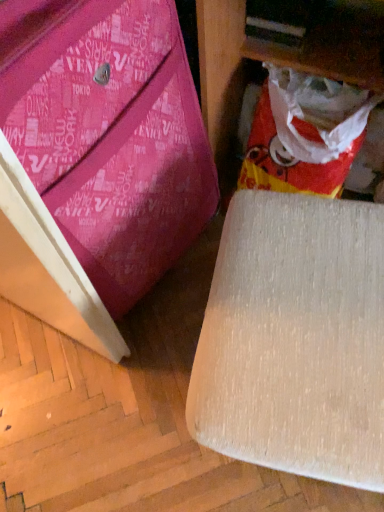
Question: Can you confirm if beige fabric chair at lower right, the first furniture from the right, is positioned to the left of red/yellow plastic bag at lower right?

Choices:
 (A) no
 (B) yes

Answer: (B)

Question: Is beige fabric chair at lower right, which is the 2th furniture in left-to-right order, positioned far away from red/yellow plastic bag at lower right?

Choices:
 (A) no
 (B) yes

Answer: (A)

Question: From the image's perspective, is beige fabric chair at lower right, the first furniture from the right, below red/yellow plastic bag at lower right?

Choices:
 (A) yes
 (B) no

Answer: (A)

Question: Can you confirm if beige fabric chair at lower right, the first furniture from the right, is shorter than red/yellow plastic bag at lower right?

Choices:
 (A) yes
 (B) no

Answer: (B)

Question: Considering the relative sizes of beige fabric chair at lower right, the first furniture from the right, and red/yellow plastic bag at lower right in the image provided, is beige fabric chair at lower right, the first furniture from the right, taller than red/yellow plastic bag at lower right?

Choices:
 (A) no
 (B) yes

Answer: (B)

Question: Is beige fabric chair at lower right, the first furniture from the right, placed right next to red/yellow plastic bag at lower right?

Choices:
 (A) no
 (B) yes

Answer: (A)

Question: Is red/yellow plastic bag at lower right taller than pink fabric bag at lower left, acting as the 2th furniture starting from the right?

Choices:
 (A) yes
 (B) no

Answer: (B)

Question: Can you confirm if red/yellow plastic bag at lower right is shorter than pink fabric bag at lower left, which ranks as the 1th furniture in left-to-right order?

Choices:
 (A) yes
 (B) no

Answer: (A)

Question: Is red/yellow plastic bag at lower right touching pink fabric bag at lower left, acting as the 2th furniture starting from the right?

Choices:
 (A) yes
 (B) no

Answer: (B)

Question: From a real-world perspective, is red/yellow plastic bag at lower right on top of pink fabric bag at lower left, which ranks as the 1th furniture in left-to-right order?

Choices:
 (A) no
 (B) yes

Answer: (A)

Question: Does red/yellow plastic bag at lower right have a lesser width compared to pink fabric bag at lower left, which ranks as the 1th furniture in left-to-right order?

Choices:
 (A) no
 (B) yes

Answer: (B)

Question: Does red/yellow plastic bag at lower right lie in front of pink fabric bag at lower left, acting as the 2th furniture starting from the right?

Choices:
 (A) yes
 (B) no

Answer: (B)

Question: Considering the relative sizes of beige fabric chair at lower right, which is the 2th furniture in left-to-right order, and pink fabric bag at lower left, acting as the 2th furniture starting from the right, in the image provided, is beige fabric chair at lower right, which is the 2th furniture in left-to-right order, shorter than pink fabric bag at lower left, acting as the 2th furniture starting from the right,?

Choices:
 (A) no
 (B) yes

Answer: (B)